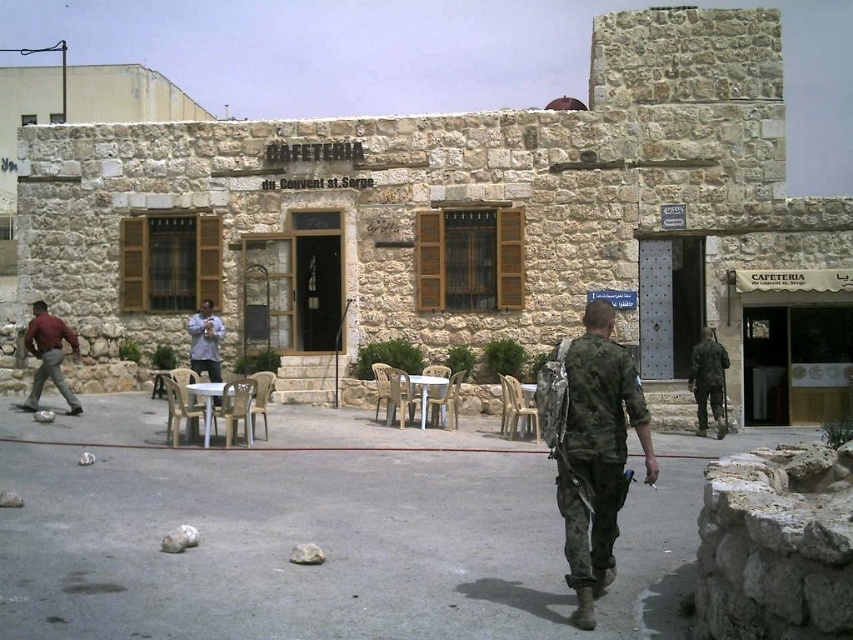
You are standing at the entrance of the CAFETERIA du Couvent st.Serge and want to find the nearest rock. You see two points marked as point 1 at coordinates (581, 627) and point 2 at (38, 385). According to the image, which point is closer to you?

Point 1 at coordinates (581, 627) is in front of point 2 at (38, 385), so point 1 is closer to you.

You are standing in front of the cafeteria and see the camouflage uniform at center and the matte red shirt at left. Which one is nearer to you?

The camouflage uniform at center is closer to the viewer than the matte red shirt at left.